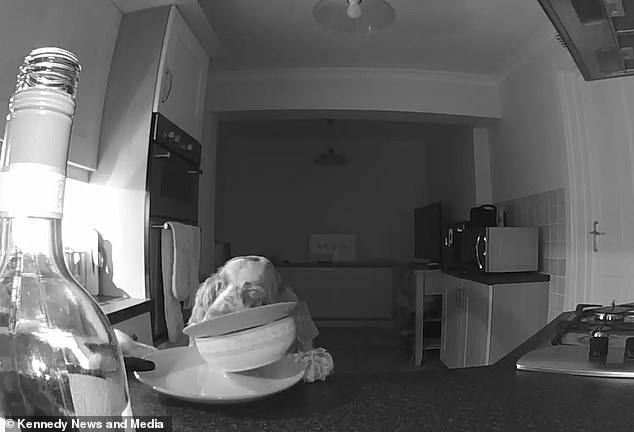
You are a GUI agent. You are given a task and a screenshot of the screen. Output one action in this format:
    pyautogui.click(x=<x>, y=<y>)
    Task: Click on the hanging ceiling lights
    
    Given the screenshot: What is the action you would take?
    pyautogui.click(x=331, y=154), pyautogui.click(x=351, y=9)